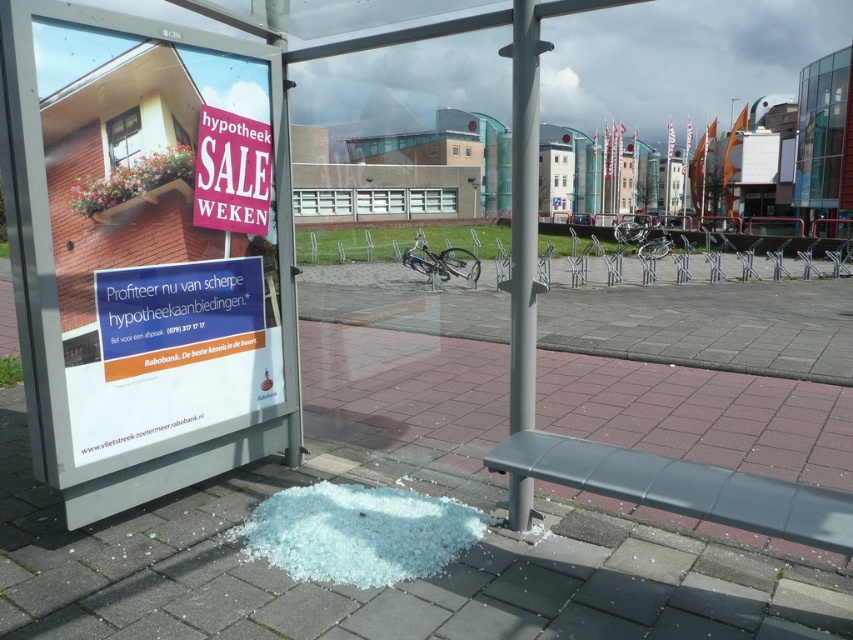
Consider the image. Is white glossy poster at left wider than metallic gray pole at center?

Indeed, white glossy poster at left has a greater width compared to metallic gray pole at center.

Looking at this image, which is more to the right, white glossy poster at left or metallic gray pole at center?

metallic gray pole at center is more to the right.

Between point (262, 92) and point (521, 108), which one is positioned behind?

Positioned behind is point (262, 92).

The image size is (853, 640). I want to click on white glossy poster at left, so click(x=146, y=250).

Between metallic gray pole at center and matte pink sign at upper left, which one is positioned lower?

Positioned lower is matte pink sign at upper left.

Does metallic gray pole at center appear over matte pink sign at upper left?

Correct, metallic gray pole at center is located above matte pink sign at upper left.

What do you see at coordinates (523, 211) in the screenshot?
I see `metallic gray pole at center` at bounding box center [523, 211].

I want to click on metallic gray pole at center, so click(523, 211).

Is point (170, 99) positioned behind point (194, 177)?

No, (170, 99) is in front of (194, 177).

Who is lower down, white glossy poster at left or matte pink sign at upper left?

white glossy poster at left is below.

What do you see at coordinates (146, 250) in the screenshot?
I see `white glossy poster at left` at bounding box center [146, 250].

This screenshot has width=853, height=640. What are the coordinates of `white glossy poster at left` in the screenshot? It's located at (146, 250).